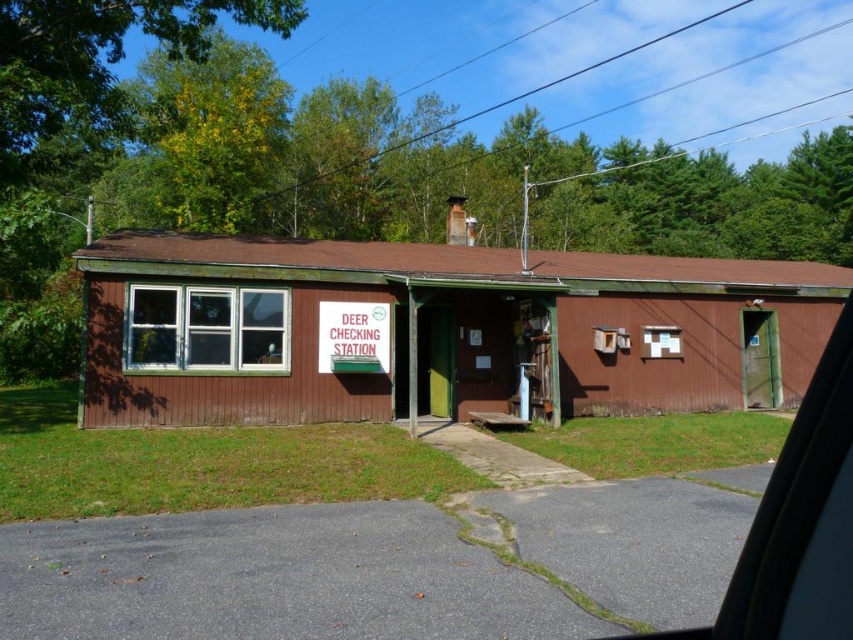
Between brown woodshed at center and white plastic sign at center, which one has less height?

white plastic sign at center is shorter.

Is the position of brown woodshed at center less distant than that of white plastic sign at center?

Yes, it is in front of white plastic sign at center.

What do you see at coordinates (437, 330) in the screenshot? The width and height of the screenshot is (853, 640). I see `brown woodshed at center` at bounding box center [437, 330].

You are a GUI agent. You are given a task and a screenshot of the screen. Output one action in this format:
    pyautogui.click(x=<x>, y=<y>)
    Task: Click on the brown woodshed at center
    The image size is (853, 640).
    Given the screenshot: What is the action you would take?
    pyautogui.click(x=437, y=330)